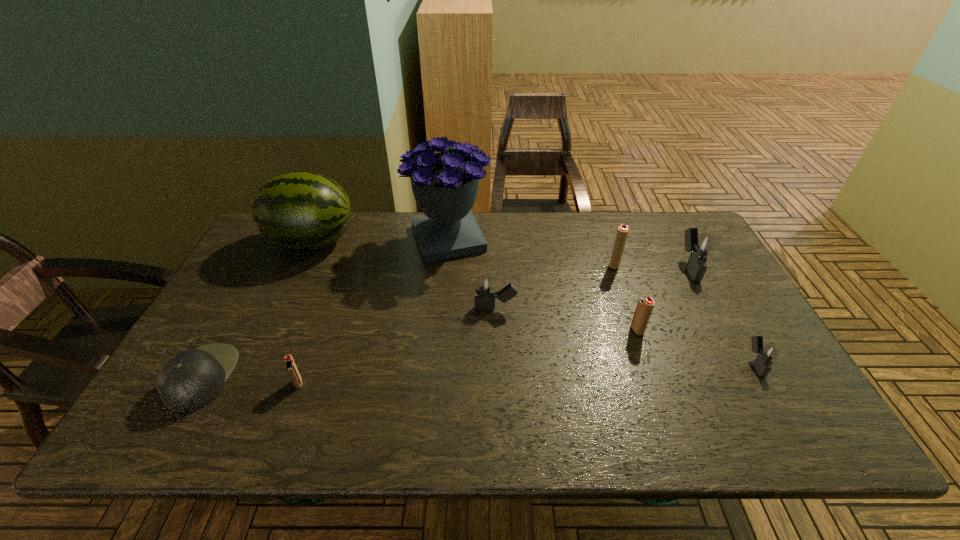
Identify which igniter is the sixth closest to the tallest object. Please provide its 2D coordinates. Your answer should be formatted as a tuple, i.e. [(x, y)], where the tuple contains the x and y coordinates of a point satisfying the conditions above.

[(766, 356)]

Identify which red igniter is the second nearest to the farthest gray igniter. Please provide its 2D coordinates. Your answer should be formatted as a tuple, i.e. [(x, y)], where the tuple contains the x and y coordinates of a point satisfying the conditions above.

[(645, 305)]

The image size is (960, 540). I want to click on red igniter that is the second closest one to the second farthest gray igniter, so click(x=622, y=232).

Identify which gray igniter is the third closest to the green watermelon. Please provide its 2D coordinates. Your answer should be formatted as a tuple, i.e. [(x, y)], where the tuple contains the x and y coordinates of a point satisfying the conditions above.

[(766, 356)]

At what (x,y) coordinates should I click in order to perform the action: click on the third closest gray igniter to the biggest red igniter. Please return your answer as a coordinate pair (x, y). The image size is (960, 540). Looking at the image, I should click on (766, 356).

At what (x,y) coordinates should I click in order to perform the action: click on free space that satisfies the following two spatial constraints: 1. on the back side of the second smallest red igniter; 2. on the right side of the leftmost igniter. Please return your answer as a coordinate pair (x, y). This screenshot has height=540, width=960. Looking at the image, I should click on (318, 330).

Find the location of `vacant point that satisfies the following two spatial constraints: 1. at the stem end of the watermelon; 2. on the back side of the biggest red igniter`. vacant point that satisfies the following two spatial constraints: 1. at the stem end of the watermelon; 2. on the back side of the biggest red igniter is located at coordinates (301, 265).

In order to click on free space that satisfies the following two spatial constraints: 1. at the stem end of the watermelon; 2. on the right side of the nearest red igniter in this screenshot , I will do `click(247, 383)`.

The image size is (960, 540). I want to click on free space that satisfies the following two spatial constraints: 1. on the brim of the cap; 2. on the right side of the nearest red igniter, so [199, 383].

The width and height of the screenshot is (960, 540). Find the location of `vacant region that satisfies the following two spatial constraints: 1. at the stem end of the second farthest red igniter; 2. on the right side of the green watermelon`. vacant region that satisfies the following two spatial constraints: 1. at the stem end of the second farthest red igniter; 2. on the right side of the green watermelon is located at coordinates (271, 330).